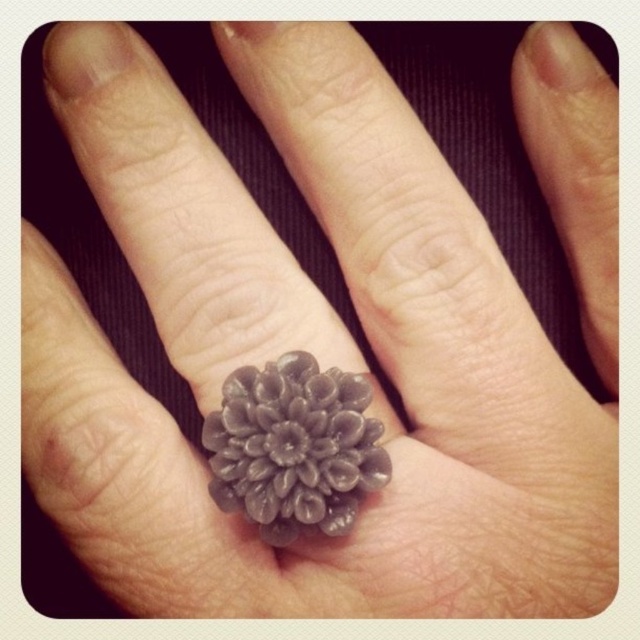
Question: Among these objects, which one is nearest to the camera?

Choices:
 (A) satin gray ring at center
 (B) matte gray petal at upper right

Answer: (A)

Question: Is satin gray ring at center above matte gray petal at upper right?

Choices:
 (A) yes
 (B) no

Answer: (B)

Question: Which of the following is the closest to the observer?

Choices:
 (A) (246, 394)
 (B) (529, 49)

Answer: (A)

Question: Is satin gray ring at center to the left of matte gray petal at upper right from the viewer's perspective?

Choices:
 (A) yes
 (B) no

Answer: (A)

Question: Is satin gray ring at center positioned behind matte gray petal at upper right?

Choices:
 (A) no
 (B) yes

Answer: (A)